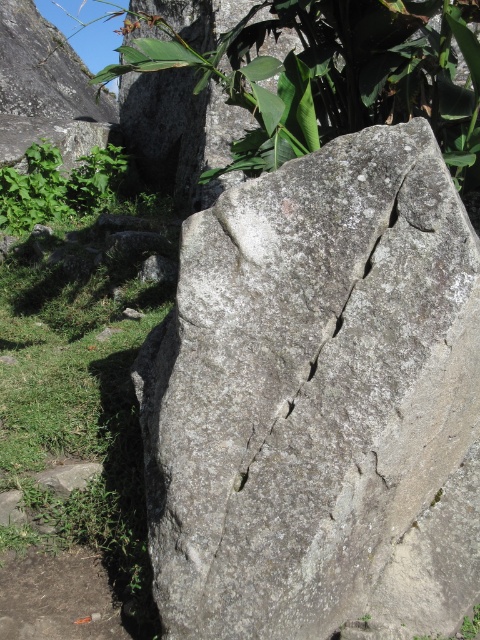
Does gray rough rock at center appear under green leafy plant at center?

Yes.

Consider the image. Who is shorter, gray rough rock at center or green leafy plant at center?

With less height is green leafy plant at center.

Between point (363, 554) and point (464, 168), which one is positioned behind?

The point (464, 168) is more distant.

Where is `gray rough rock at center`? This screenshot has width=480, height=640. gray rough rock at center is located at coordinates (315, 397).